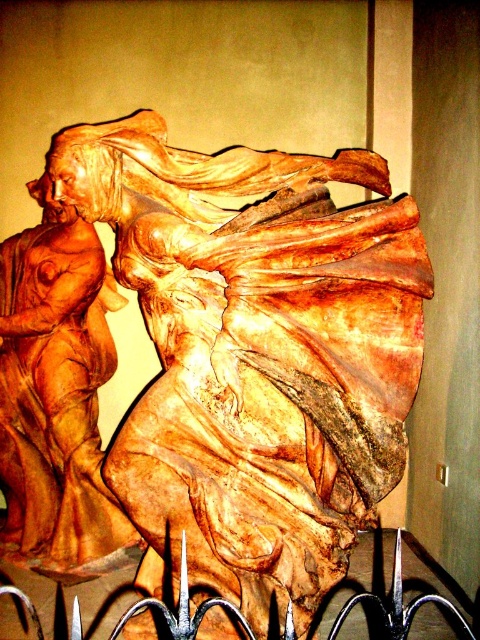
You are standing in front of the wooden sculpture and want to take a photo of the point at coordinate point (271, 589). If your camera has a focal length of 50mm and you are 3.79 meters away from the point, what is the angle of view required to capture the point in the center of your photo?

The point at coordinate point (271, 589) is 3.79 meters from the camera. To calculate the angle of view required, use the formula angle of view arctangent of half the sensor width divided by focal length times distance. However, without sensor size, it can be estimated that a 50mm lens at 3.79 meters distance would have a narrow angle of view, so you might need a wider lens or adjust your position closer to ensure the point is centered and in frame.

You are standing in front of the wooden sculpture. What are the coordinates of the wooden statue at center?

The wooden statue at center is located at coordinates point (255, 355).

You are standing in front of a wooden sculpture. There is a point at coordinates (255, 355). What does this point represent?

The point at coordinates (255, 355) represents the wooden statue at center.